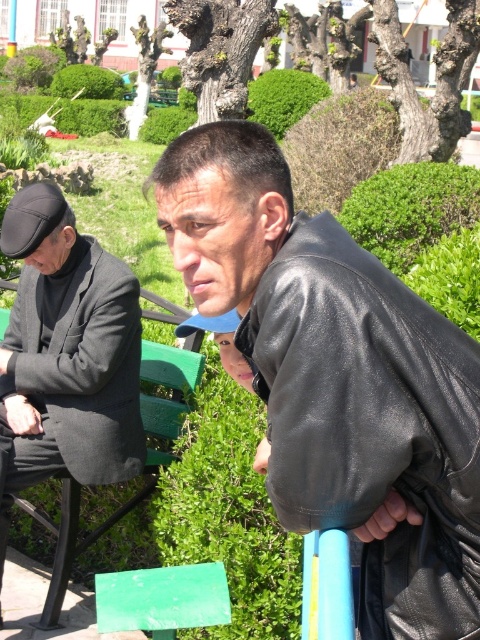
You are standing in the park and see the black leather jacket at upper right and the green leafy hedge at upper center. Which object is closer to the left side of the scene?

The black leather jacket at upper right is to the left of the green leafy hedge at upper center, so it is closer to the left side of the scene.

Consider the image. You are standing at the origin of the coordinate system in the image. The black leather jacket at upper right is located at point (x=371, y=426). If you want to walk directly towards the black leather jacket at upper right, which direction should you move?

To walk directly towards the black leather jacket at upper right located at point (x=371, y=426), you should move northeast since the coordinates indicate it is in the upper right quadrant.

You are standing at the camera position and want to hand a leaflet to the person wearing the black leather jacket at upper right. Can you reach them without moving from your current position if your arm can extend 0.8 meters?

The distance between the black leather jacket at upper right and the camera is 1.70 meters. Since your arm can only extend 0.8 meters, you cannot reach them without moving.